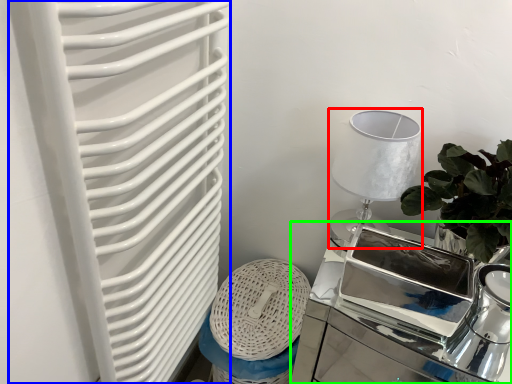
Question: Considering the real-world distances, which object is farthest from table lamp (highlighted by a red box)? radiator (highlighted by a blue box) or table (highlighted by a green box)?

Choices:
 (A) radiator
 (B) table

Answer: (A)